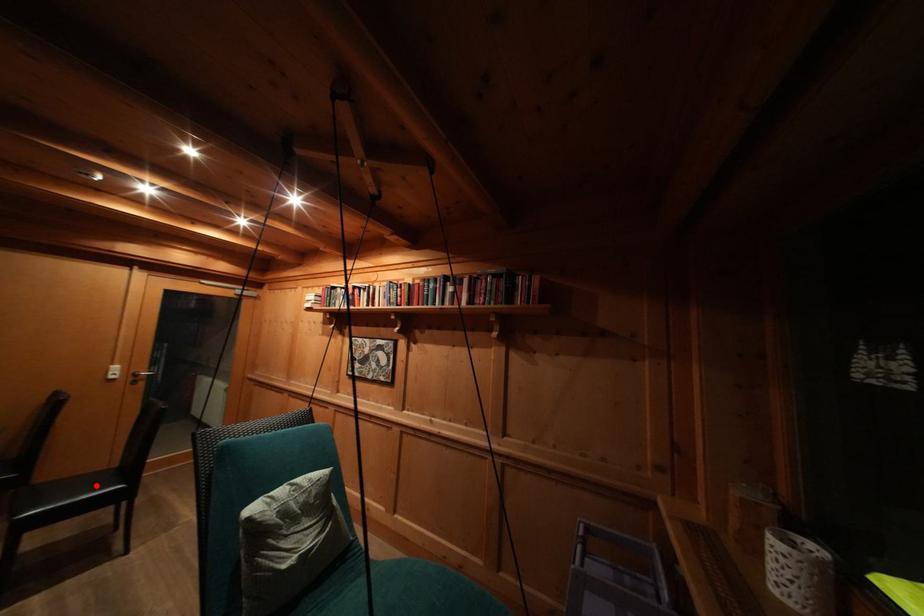
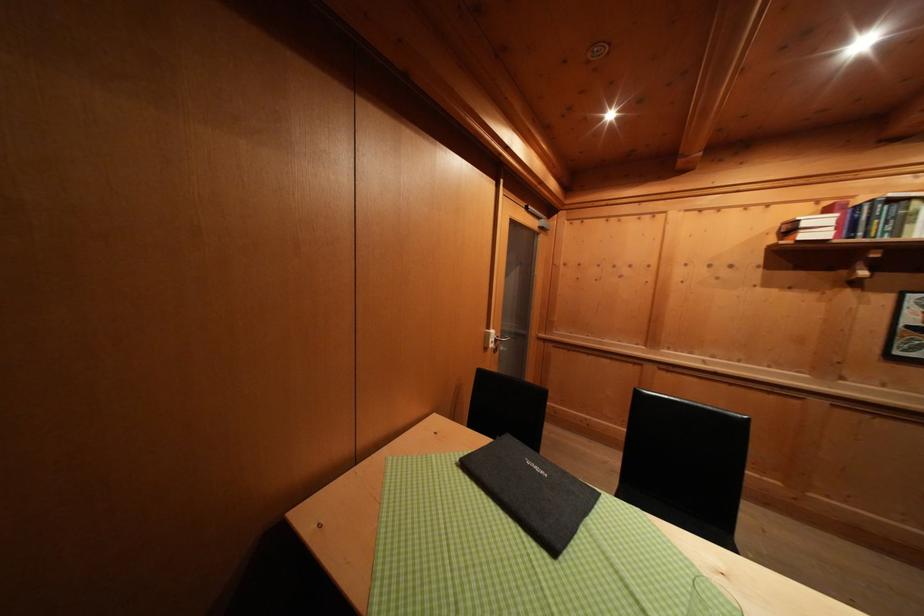
Question: I am providing you with two images of the same scene from different viewpoints. A red point is marked on the first image. At the location where the point appears in image 1, is it still visible in image 2?

Choices:
 (A) Yes
 (B) No

Answer: (B)